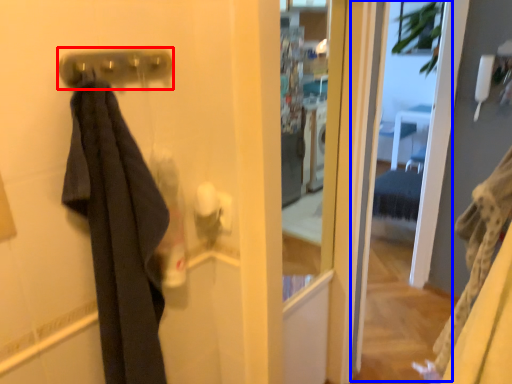
Question: Which of the following is the closest to the observer, door handle (highlighted by a red box) or screen door (highlighted by a blue box)?

Choices:
 (A) door handle
 (B) screen door

Answer: (A)